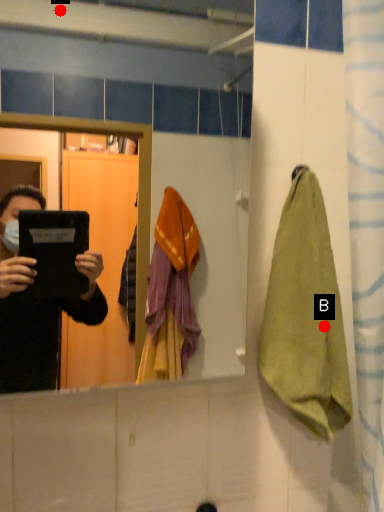
Question: Two points are circled on the image, labeled by A and B beside each circle. Which point is closer to the camera?

Choices:
 (A) A is closer
 (B) B is closer

Answer: (B)